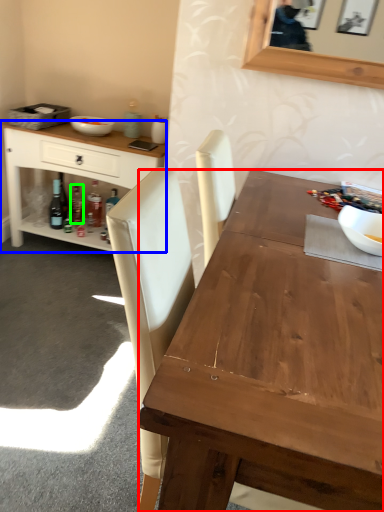
Question: Which object is the farthest from desk (highlighted by a red box)? Choose among these: cabinetry (highlighted by a blue box) or bottle (highlighted by a green box).

Choices:
 (A) cabinetry
 (B) bottle

Answer: (B)